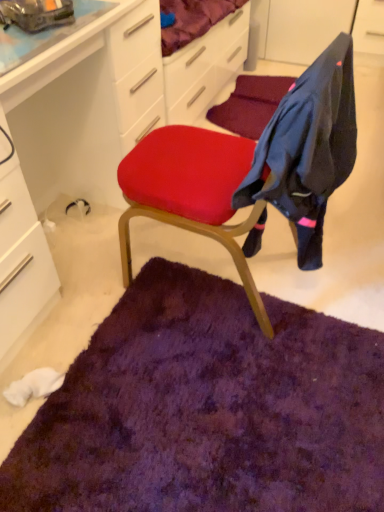
Question: From a real-world perspective, is purple shaggy rug at center located higher than white glossy computer desk at upper left?

Choices:
 (A) yes
 (B) no

Answer: (B)

Question: Does purple shaggy rug at center have a smaller size compared to white glossy computer desk at upper left?

Choices:
 (A) yes
 (B) no

Answer: (A)

Question: Considering the relative sizes of purple shaggy rug at center and white glossy computer desk at upper left in the image provided, is purple shaggy rug at center bigger than white glossy computer desk at upper left?

Choices:
 (A) no
 (B) yes

Answer: (A)

Question: Does purple shaggy rug at center appear on the right side of white glossy computer desk at upper left?

Choices:
 (A) yes
 (B) no

Answer: (A)

Question: Can you confirm if purple shaggy rug at center is wider than white glossy computer desk at upper left?

Choices:
 (A) no
 (B) yes

Answer: (B)

Question: Is purple shaggy rug at center oriented away from white glossy computer desk at upper left?

Choices:
 (A) no
 (B) yes

Answer: (A)

Question: Are white glossy computer desk at upper left and purple shaggy rug at center far apart?

Choices:
 (A) yes
 (B) no

Answer: (B)

Question: Can you confirm if white glossy computer desk at upper left is positioned to the right of purple shaggy rug at center?

Choices:
 (A) yes
 (B) no

Answer: (B)

Question: Is white glossy computer desk at upper left positioned before purple shaggy rug at center?

Choices:
 (A) no
 (B) yes

Answer: (B)

Question: Could you tell me if white glossy computer desk at upper left is facing purple shaggy rug at center?

Choices:
 (A) yes
 (B) no

Answer: (A)

Question: Considering the relative sizes of white glossy computer desk at upper left and purple shaggy rug at center in the image provided, is white glossy computer desk at upper left thinner than purple shaggy rug at center?

Choices:
 (A) yes
 (B) no

Answer: (A)

Question: Does white glossy computer desk at upper left appear on the left side of purple shaggy rug at center?

Choices:
 (A) no
 (B) yes

Answer: (B)

Question: Is purple shaggy rug at center located within dark blue fabric at upper right?

Choices:
 (A) yes
 (B) no

Answer: (B)